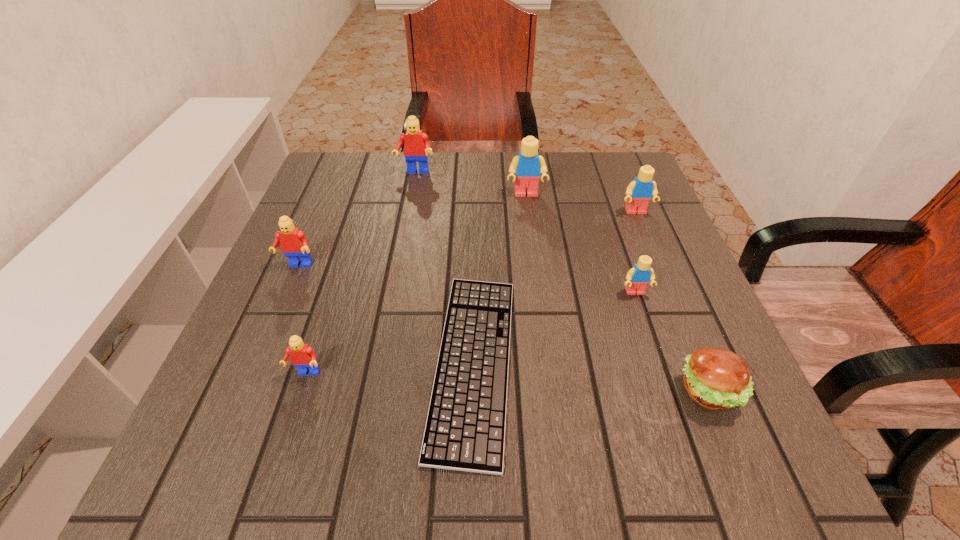
You are a GUI agent. You are given a task and a screenshot of the screen. Output one action in this format:
    pyautogui.click(x=<x>, y=<y>)
    Task: Click on the fifth nearest Lego
    The image size is (960, 540).
    Given the screenshot: What is the action you would take?
    pyautogui.click(x=528, y=166)

The width and height of the screenshot is (960, 540). I want to click on the leftmost yellow Lego, so (x=528, y=166).

The image size is (960, 540). Find the location of `the farthest red Lego`. the farthest red Lego is located at coordinates (416, 146).

I want to click on the farthest Lego, so click(x=416, y=146).

The image size is (960, 540). What are the coordinates of `the second nearest yellow Lego` in the screenshot? It's located at (639, 192).

Where is `the fourth nearest Lego`? The width and height of the screenshot is (960, 540). the fourth nearest Lego is located at coordinates (639, 192).

At what (x,y) coordinates should I click in order to perform the action: click on the leftmost red Lego. Please return your answer as a coordinate pair (x, y). The image size is (960, 540). Looking at the image, I should click on (293, 243).

This screenshot has width=960, height=540. Find the location of `the fifth nearest object`. the fifth nearest object is located at coordinates (293, 243).

Locate an element on the screen. The image size is (960, 540). the nearest yellow Lego is located at coordinates (638, 277).

Where is `the smallest yellow Lego`? The width and height of the screenshot is (960, 540). the smallest yellow Lego is located at coordinates (638, 277).